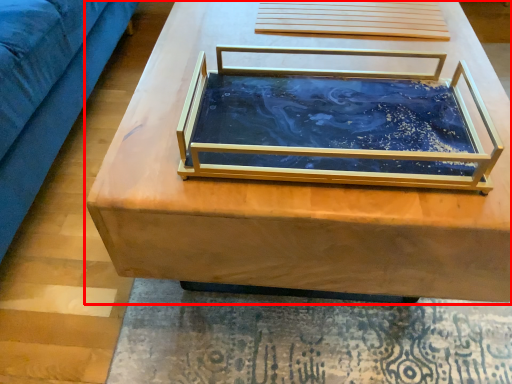
Question: Considering the relative positions of table (annotated by the red box) and glass box in the image provided, where is table (annotated by the red box) located with respect to the staircase?

Choices:
 (A) left
 (B) right

Answer: (B)